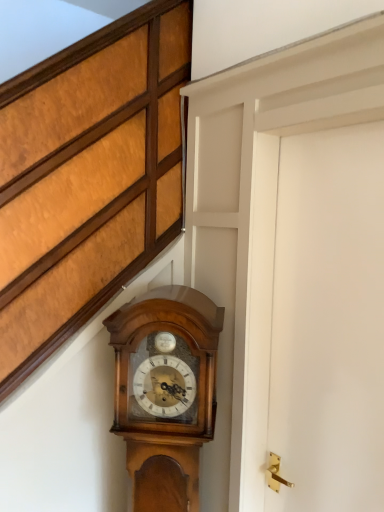
Question: In terms of height, does polished wood wall clock at center look taller or shorter compared to white matte door at right?

Choices:
 (A) tall
 (B) short

Answer: (B)

Question: Considering the positions of point (178, 353) and point (281, 270), is point (178, 353) closer or farther from the camera than point (281, 270)?

Choices:
 (A) farther
 (B) closer

Answer: (B)

Question: Which is correct: polished wood wall clock at center is inside white matte door at right, or outside of it?

Choices:
 (A) inside
 (B) outside

Answer: (B)

Question: From a real-world perspective, is white matte door at right above or below polished wood wall clock at center?

Choices:
 (A) above
 (B) below

Answer: (A)

Question: From the image's perspective, relative to polished wood wall clock at center, is white matte door at right above or below?

Choices:
 (A) below
 (B) above

Answer: (B)

Question: Considering the positions of white matte door at right and polished wood wall clock at center in the image, is white matte door at right wider or thinner than polished wood wall clock at center?

Choices:
 (A) thin
 (B) wide

Answer: (A)

Question: In terms of size, does white matte door at right appear bigger or smaller than polished wood wall clock at center?

Choices:
 (A) small
 (B) big

Answer: (A)